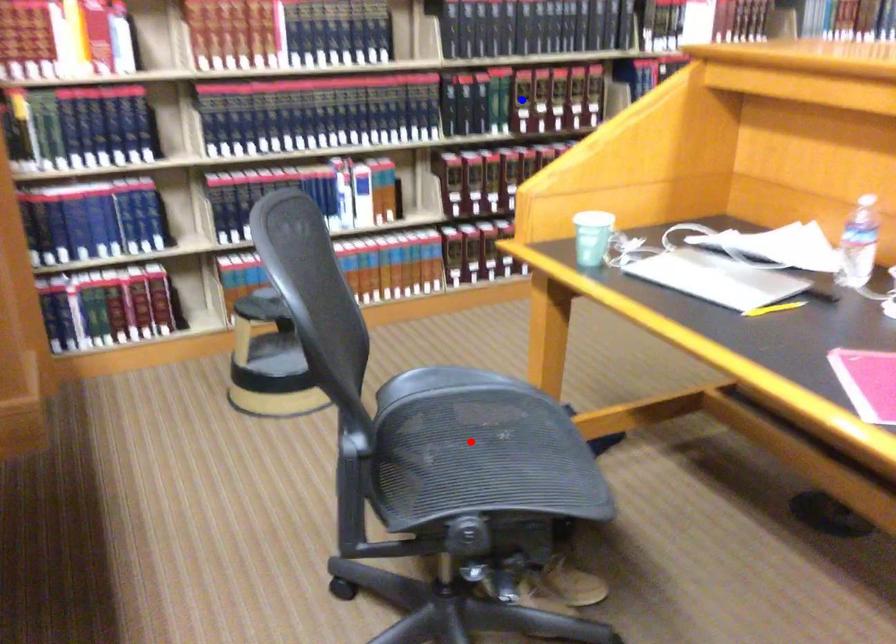
Question: Which of the two points in the image is closer to the camera?

Choices:
 (A) Blue point is closer.
 (B) Red point is closer.

Answer: (B)